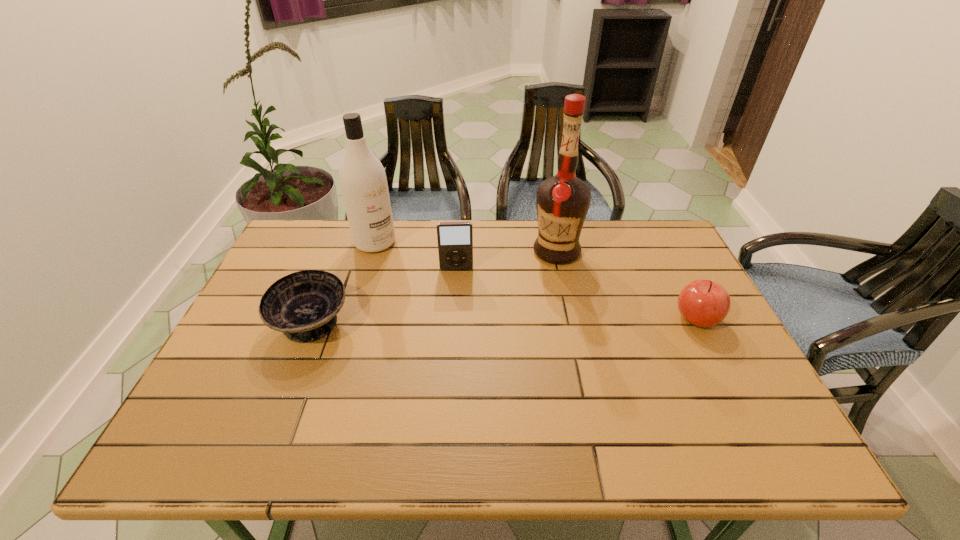
Find the location of a particular element. This screenshot has height=540, width=960. vacant spot on the desktop that is between the bowl and the fourth tallest object and is positioned on the front and back of the liquor is located at coordinates (460, 322).

Locate an element on the screen. The image size is (960, 540). free space on the desktop that is between the bowl and the apple and is positioned on the front-facing side of the second tallest object is located at coordinates click(456, 322).

Where is `vacant spot on the desktop that is between the shortest object and the apple and is positioned on the front-facing side of the iPod`? This screenshot has width=960, height=540. vacant spot on the desktop that is between the shortest object and the apple and is positioned on the front-facing side of the iPod is located at coordinates (457, 322).